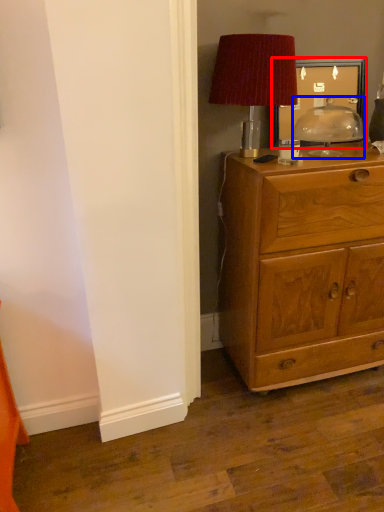
Question: Which of the following is the farthest to the observer, picture frame (highlighted by a red box) or table lamp (highlighted by a blue box)?

Choices:
 (A) picture frame
 (B) table lamp

Answer: (A)